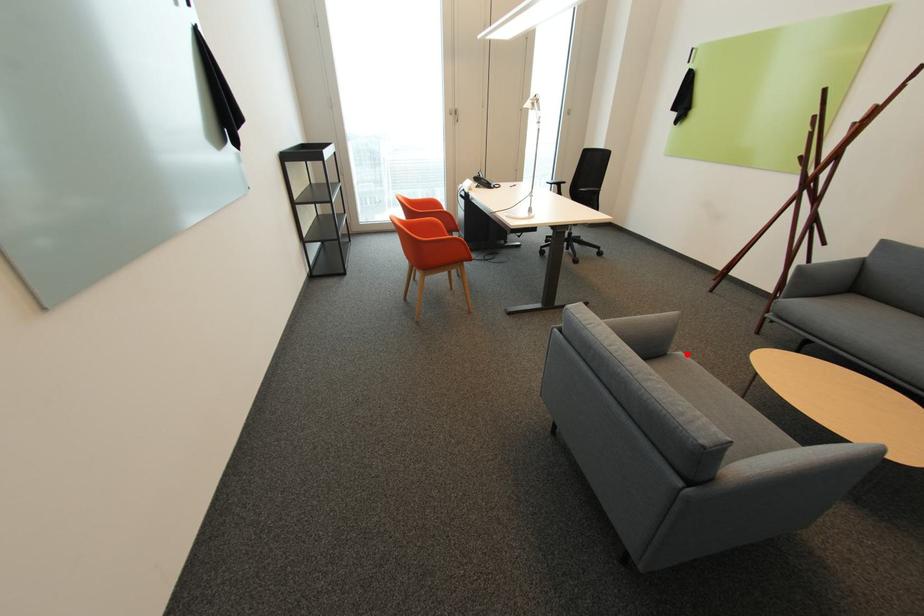
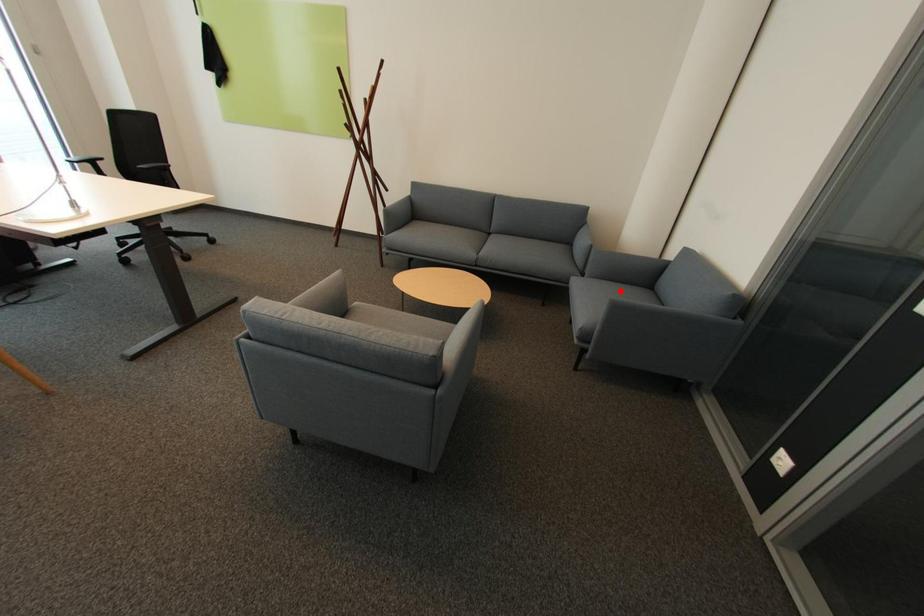
I am providing you with two images of the same scene from different viewpoints. A red point is marked on the first image and another point is marked on the second image. Do the highlighted points in image1 and image2 indicate the same real-world spot?

No